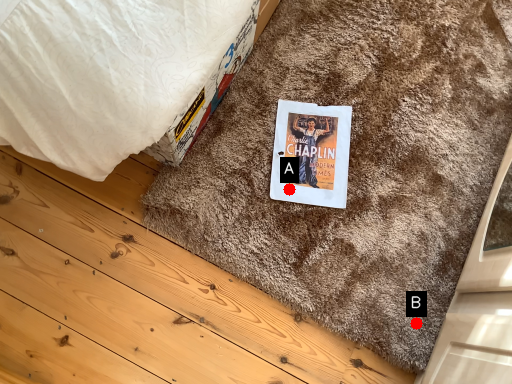
Question: Two points are circled on the image, labeled by A and B beside each circle. Which point is closer to the camera?

Choices:
 (A) A is closer
 (B) B is closer

Answer: (B)